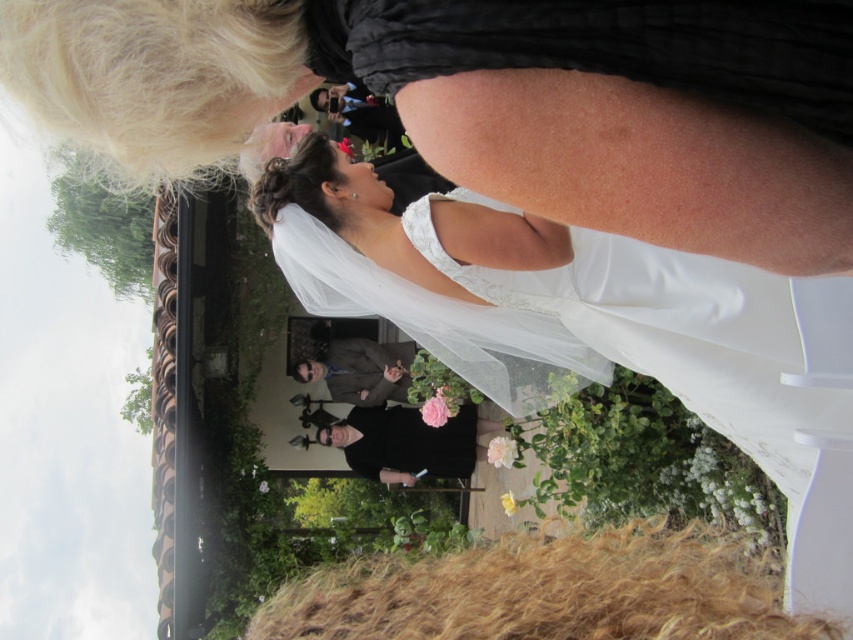
You are a photographer at the wedding and need to ensure that the white lace veil at center and the dark gray suit at center are both visible in the photo. Given that the veil is narrower than the suit, which object should you prioritize framing closer to the camera to avoid cropping?

Since the white lace veil at center is narrower than the dark gray suit at center, you should prioritize framing the white lace veil at center closer to the camera to ensure it is fully visible without cropping.

You are a photographer standing at the back of the garden. You need to take a photo of both the satin white dress at center and the black satin suit at center so that they are clearly visible in the same frame. Given that your camera has a maximum focus range of 50 feet, will you be able to capture both subjects in focus?

The distance between the satin white dress at center and the black satin suit at center is 57.88 feet. Since the camera can only focus up to 50 feet, it will not be able to capture both subjects in focus simultaneously.

In the wedding scene, there are two central figures wearing a satin white dress at center and a black satin suit at center. From the perspective of someone facing the bride, which one is on the left side?

The black satin suit at center is on the left side because the satin white dress at center is positioned on the right side of it.